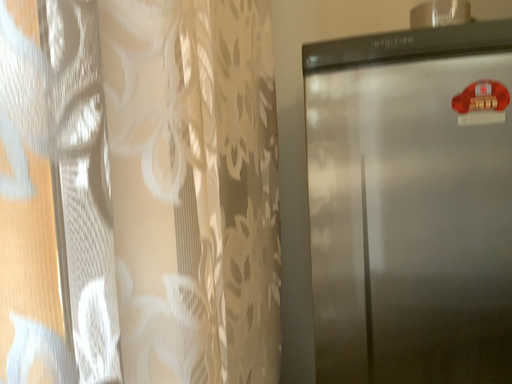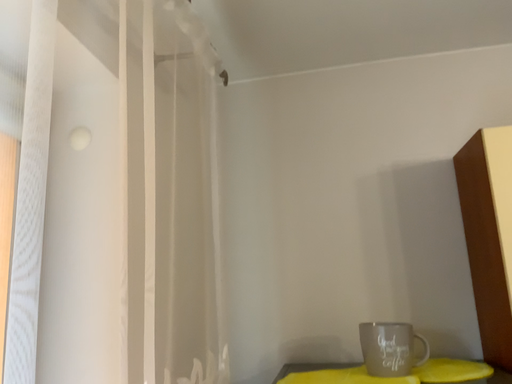
Question: Which way did the camera rotate in the video?

Choices:
 (A) rotated upward
 (B) rotated downward

Answer: (A)